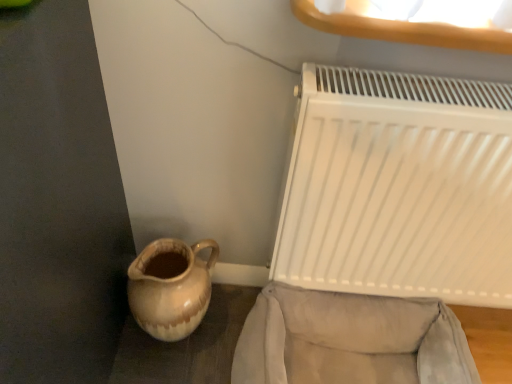
Question: Is velvet beige armchair at lower right closer to camera compared to white matte radiator at right?

Choices:
 (A) no
 (B) yes

Answer: (A)

Question: Is velvet beige armchair at lower right not inside white matte radiator at right?

Choices:
 (A) no
 (B) yes

Answer: (B)

Question: From a real-world perspective, is velvet beige armchair at lower right located higher than white matte radiator at right?

Choices:
 (A) no
 (B) yes

Answer: (A)

Question: From the image's perspective, would you say velvet beige armchair at lower right is shown under white matte radiator at right?

Choices:
 (A) yes
 (B) no

Answer: (A)

Question: Can white matte radiator at right be found inside velvet beige armchair at lower right?

Choices:
 (A) no
 (B) yes

Answer: (A)

Question: Does velvet beige armchair at lower right have a smaller size compared to white matte radiator at right?

Choices:
 (A) yes
 (B) no

Answer: (B)

Question: Is brown glazed jug at lower left directly adjacent to white matte radiator at right?

Choices:
 (A) yes
 (B) no

Answer: (B)

Question: From the image's perspective, is brown glazed jug at lower left located beneath white matte radiator at right?

Choices:
 (A) yes
 (B) no

Answer: (A)

Question: Is brown glazed jug at lower left shorter than white matte radiator at right?

Choices:
 (A) yes
 (B) no

Answer: (A)

Question: Does brown glazed jug at lower left come behind white matte radiator at right?

Choices:
 (A) no
 (B) yes

Answer: (B)

Question: From the image's perspective, does brown glazed jug at lower left appear higher than white matte radiator at right?

Choices:
 (A) no
 (B) yes

Answer: (A)

Question: Can you confirm if brown glazed jug at lower left is wider than white matte radiator at right?

Choices:
 (A) no
 (B) yes

Answer: (B)

Question: Is brown glazed jug at lower left to the right of velvet beige armchair at lower right from the viewer's perspective?

Choices:
 (A) yes
 (B) no

Answer: (B)